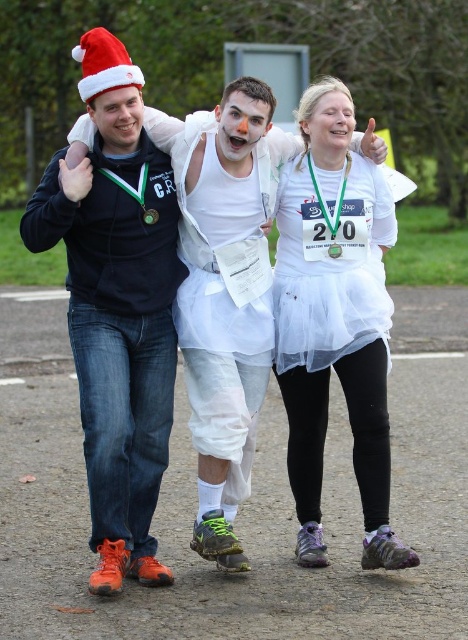
You are a photographer positioned at the camera. You want to take a photo that includes both the person with the white tulle skirt at center and the person on the left with the Santa hat. The camera can focus on objects within 5 meters. Can you capture both in focus?

The white tulle skirt at center is 6.40 meters away from camera, which is beyond the camera focus range of 5 meters. Therefore, the photographer cannot capture both in focus since the white tulle skirt at center is too far away.